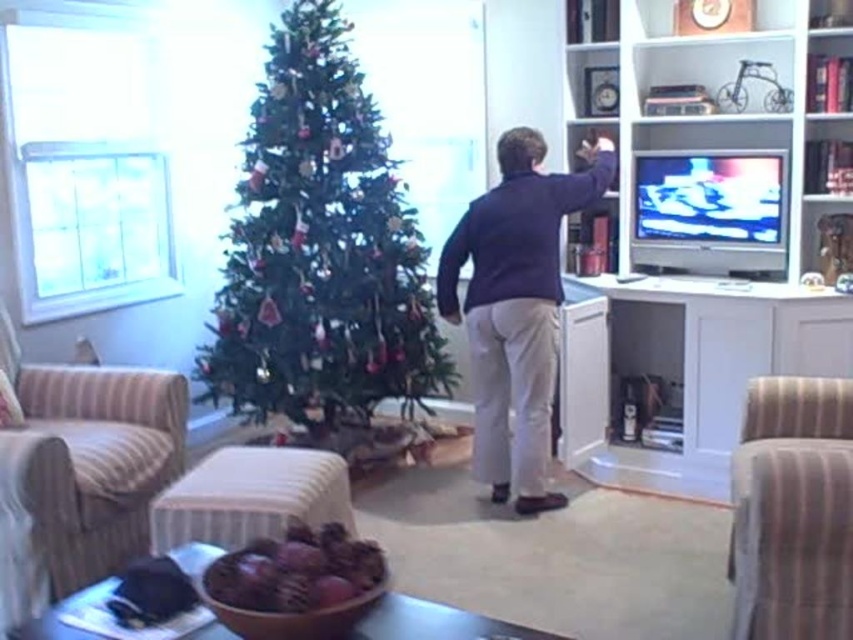
You are standing in the living room and want to pick up an object. The first object is located at point [53,458] and the second object is at point [544,429]. Which point should you move towards to reach the closer object?

Point [53,458] is closer to the viewer than point [544,429], so you should move towards point [53,458] to reach the closer object.